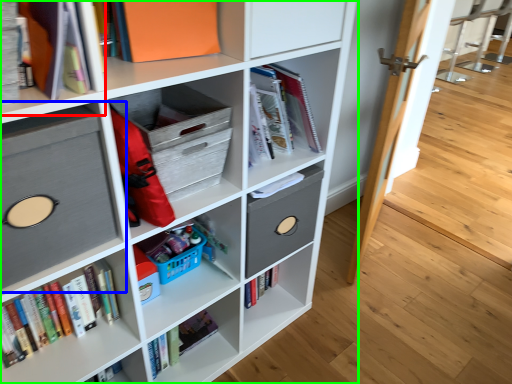
Question: Based on their relative distances, which object is farther from shelf (highlighted by a red box)? Choose from shelf (highlighted by a blue box) and shelf (highlighted by a green box).

Choices:
 (A) shelf
 (B) shelf

Answer: (B)